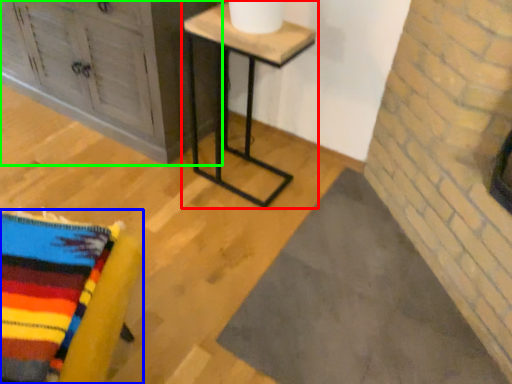
Question: Estimate the real-world distances between objects in this image. Which object is closer to table (highlighted by a red box), furniture (highlighted by a blue box) or furniture (highlighted by a green box)?

Choices:
 (A) furniture
 (B) furniture

Answer: (B)